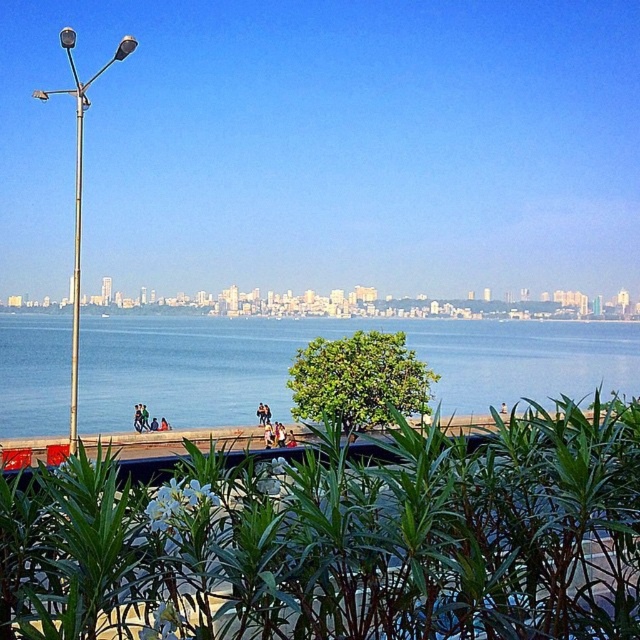
You are a landscape architect designing a new park. You want to place a bench along the walkway so that it faces the blue water at center while also having a view of the green leafy plant at center. Given their widths, which object will require more space between the bench and the walkway?

The blue water at center requires more space because its width is greater than the green leafy plant at center.

You are standing at the waterfront and want to reach a specific point marked at coordinates point (x=436, y=344). If you have a 30 meter long rope, can you use it to reach that point from where you are standing?

The point (x=436, y=344) is 32.28 meters away from the viewer. Since the rope is only 30 meters long, it is not long enough to reach the point.

You are standing on the walkway and want to take a photo of the blue water at center and the green leafy bush at center. Which one should you focus on first if you want to capture both in a single frame?

The blue water at center is above the green leafy bush at center, so you should focus on the blue water at center first to ensure both are in the frame.